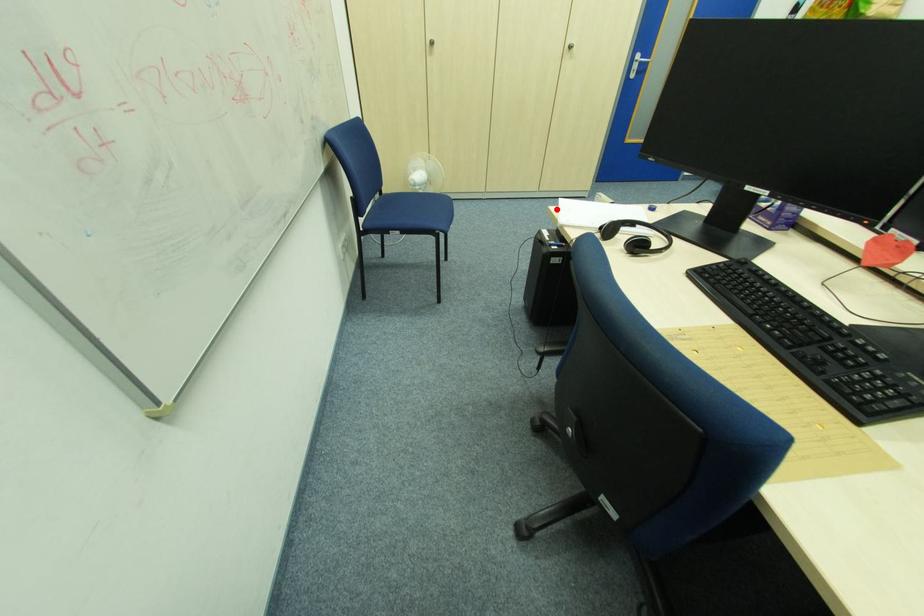
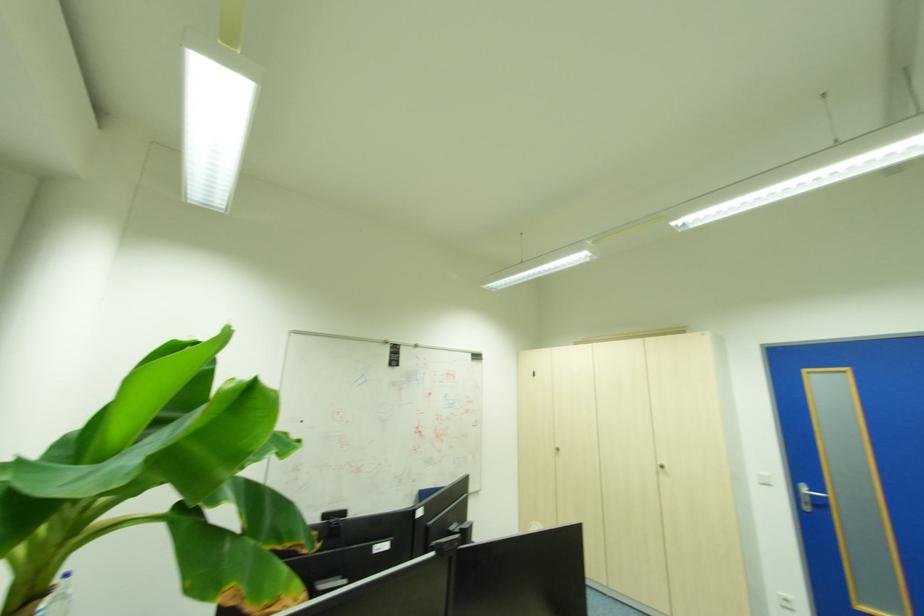
Question: I am providing you with two images of the same scene from different viewpoints. A red point is marked on the first image. At the location where the point appears in image 1, is it still visible in image 2?

Choices:
 (A) Yes
 (B) No

Answer: (B)